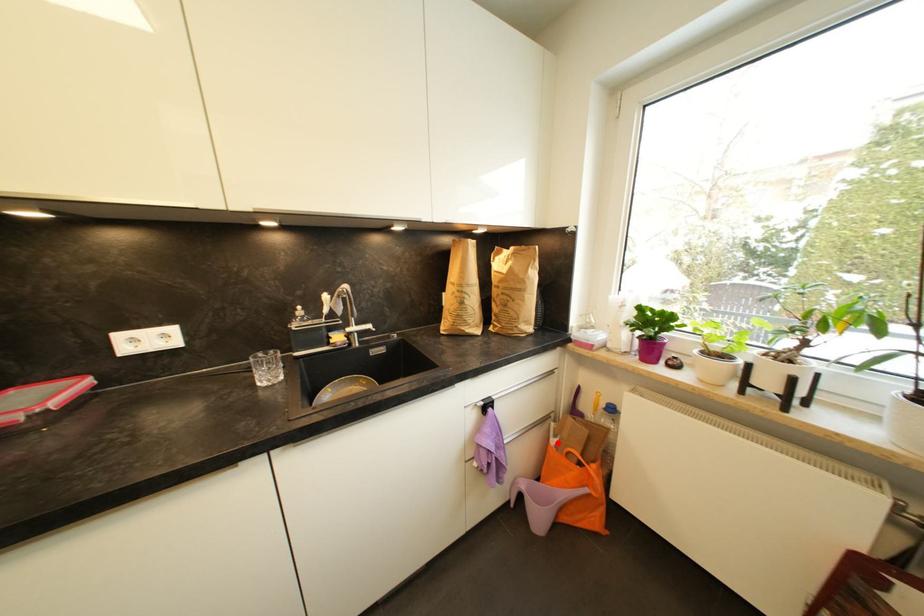
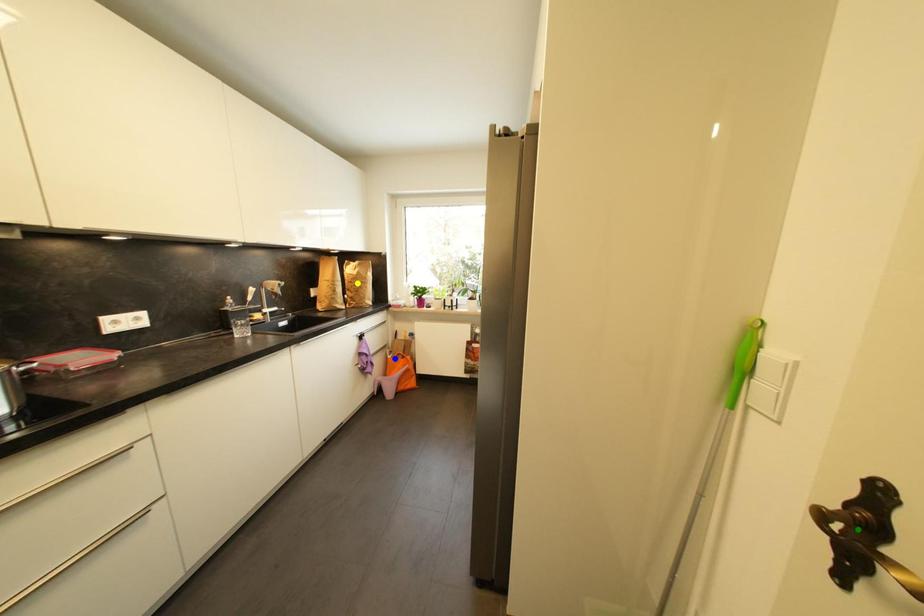
Question: I am providing you with two images of the same scene from different viewpoints. A red point is marked on the first image. You are given multiple points on the second image. Which spot in image 2 lines up with the point in image 1?

Choices:
 (A) yellow point
 (B) blue point
 (C) green point

Answer: (B)